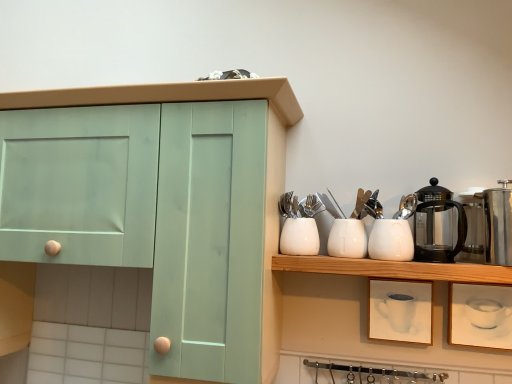
Find the location of a particular element. The width and height of the screenshot is (512, 384). vacant position to the left of clear glass carafe at upper right, the 2th appliance positioned from the right is located at coordinates (431, 261).